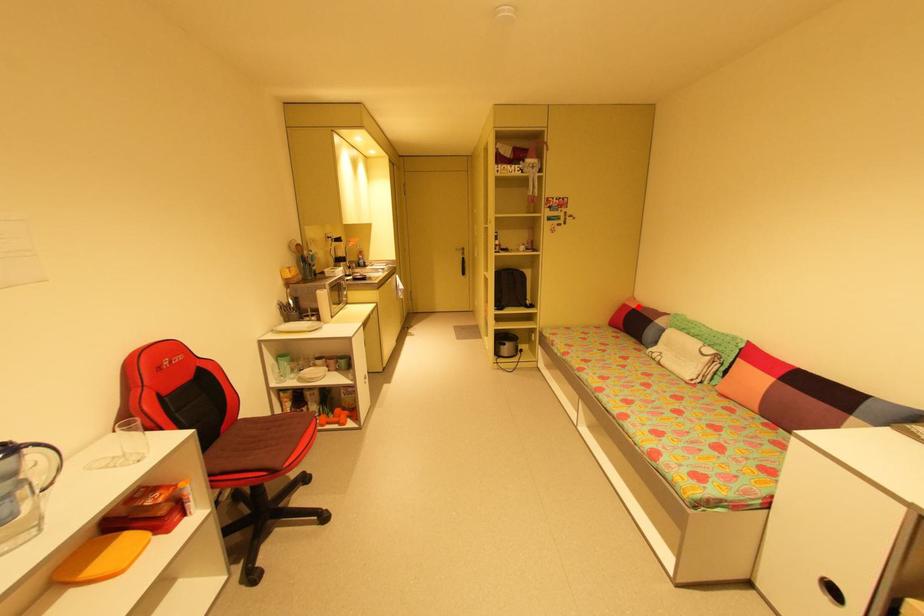
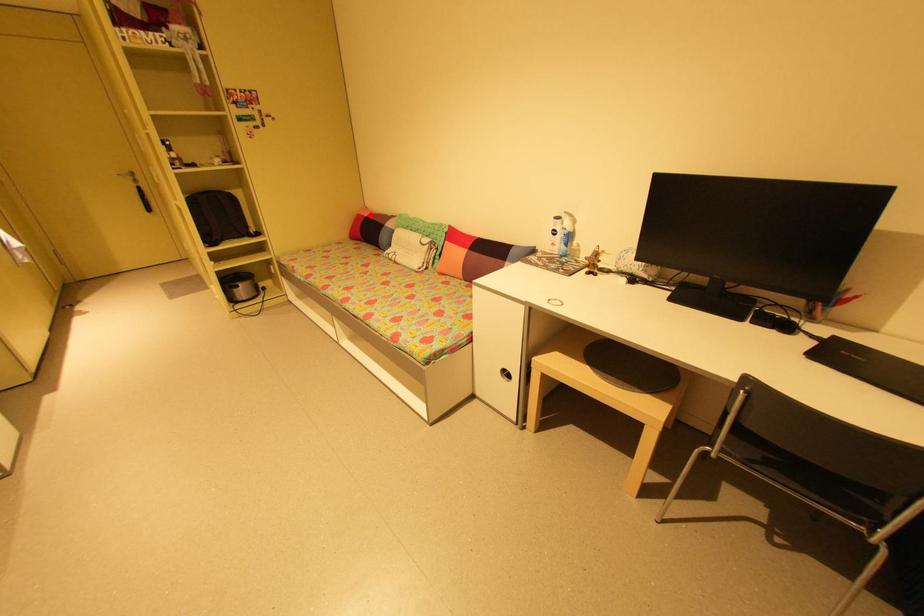
I am providing you with two images of the same scene from different viewpoints. A red point is marked on the first image and another point is marked on the second image. Is the marked point in image1 the same physical position as the marked point in image2?

Yes